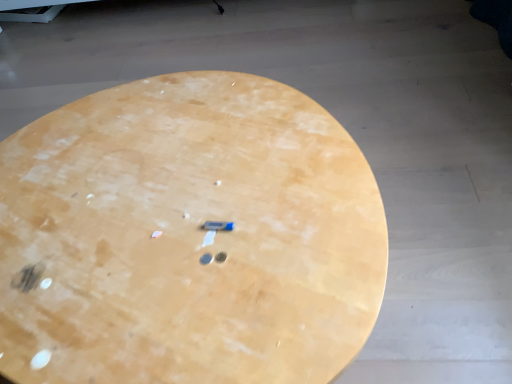
Locate an element on the screen. wooden table at center is located at coordinates (187, 237).

What is the approximate height of wooden table at center?

18.22 inches.

What do you see at coordinates (187, 237) in the screenshot?
I see `wooden table at center` at bounding box center [187, 237].

What are the coordinates of `wooden table at center` in the screenshot? It's located at (187, 237).